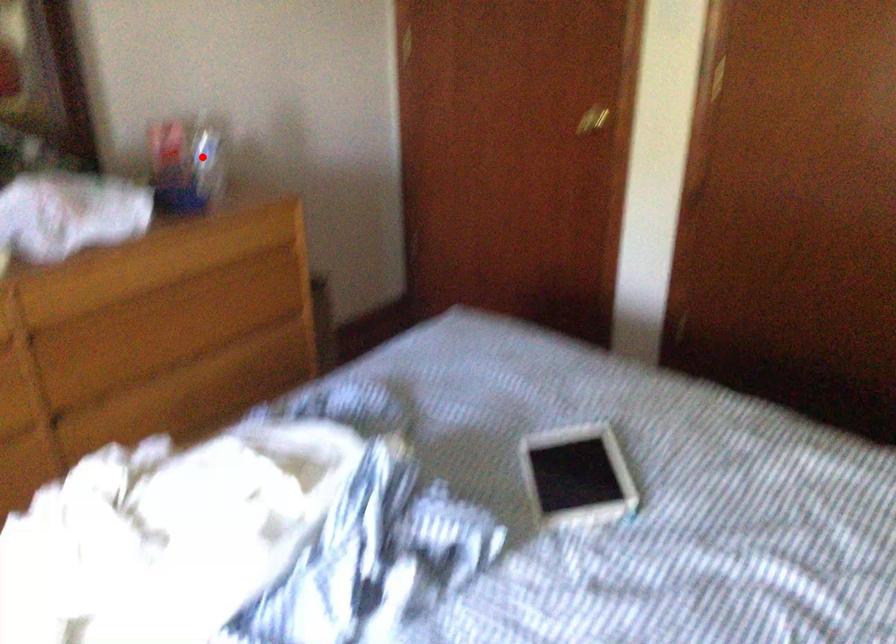
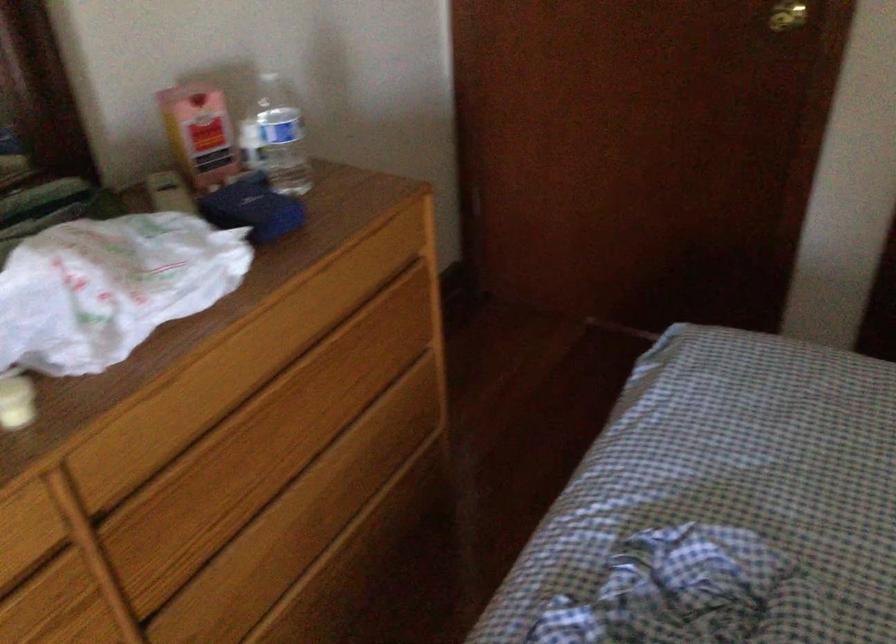
The point at the highlighted location is marked in the first image. Where is the corresponding point in the second image?

(276, 138)